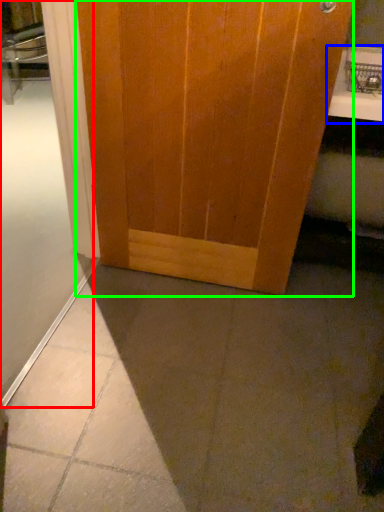
Question: Which object is positioned closest to shower door (highlighted by a red box)? Select from counter top (highlighted by a blue box) and door (highlighted by a green box).

Choices:
 (A) counter top
 (B) door

Answer: (B)